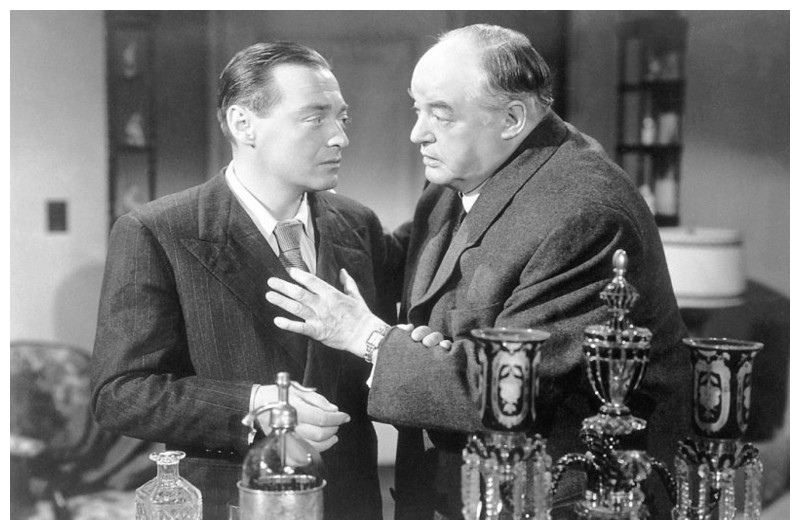
Image resolution: width=800 pixels, height=530 pixels. I want to click on bottles, so click(x=294, y=472), click(x=488, y=474), click(x=594, y=471), click(x=728, y=471), click(x=170, y=494).